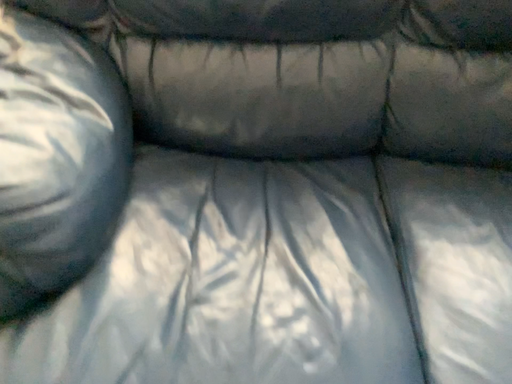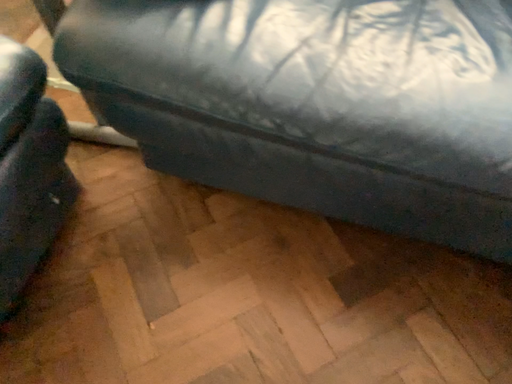
Question: How did the camera likely rotate when shooting the video?

Choices:
 (A) rotated downward
 (B) rotated upward

Answer: (A)